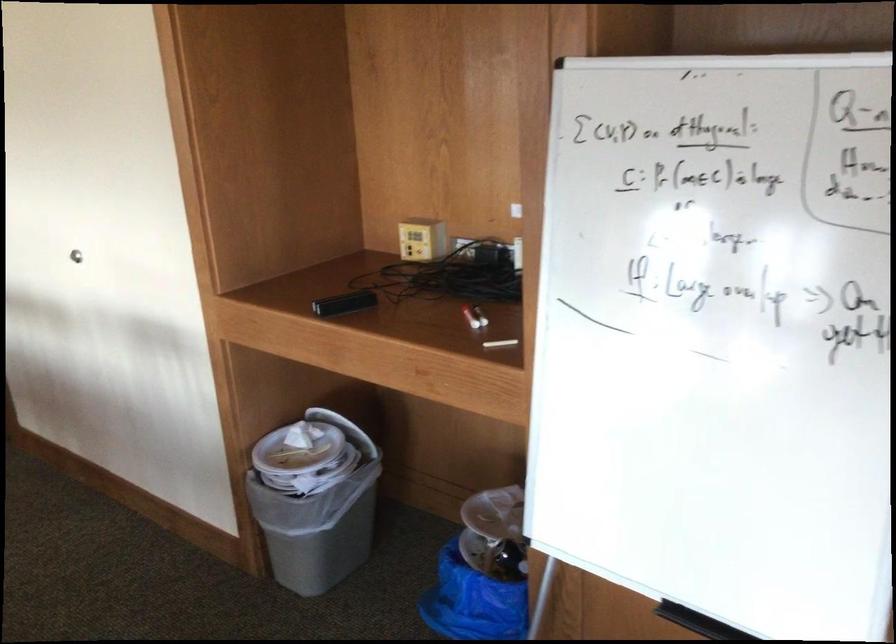
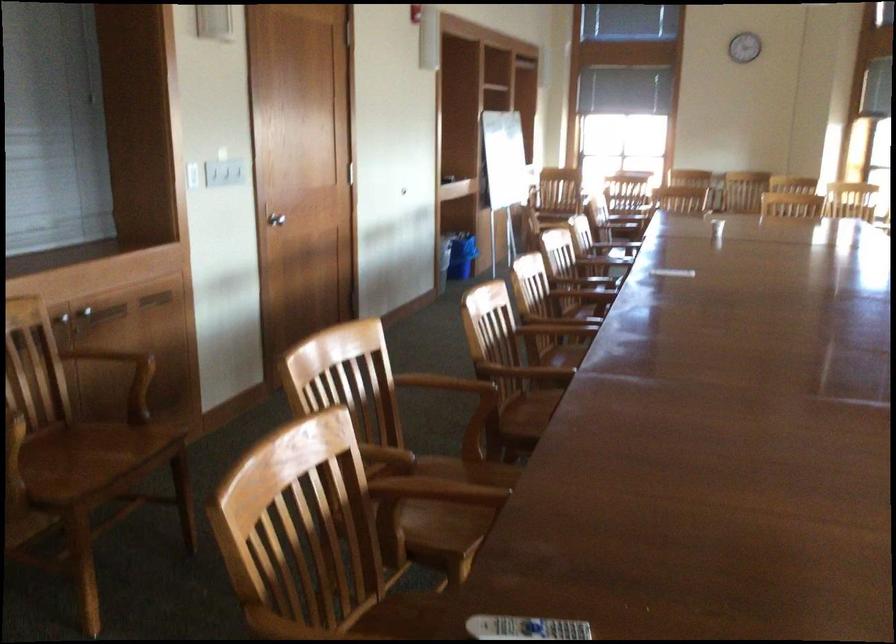
Question: I am providing you with two images of the same scene from different viewpoints. After the viewpoint changes to image2, which objects are now occluded?

Choices:
 (A) red and white marker
 (B) beige bath sponge
 (C) silver door handle
 (D) wooden chair sitting surface

Answer: (A)